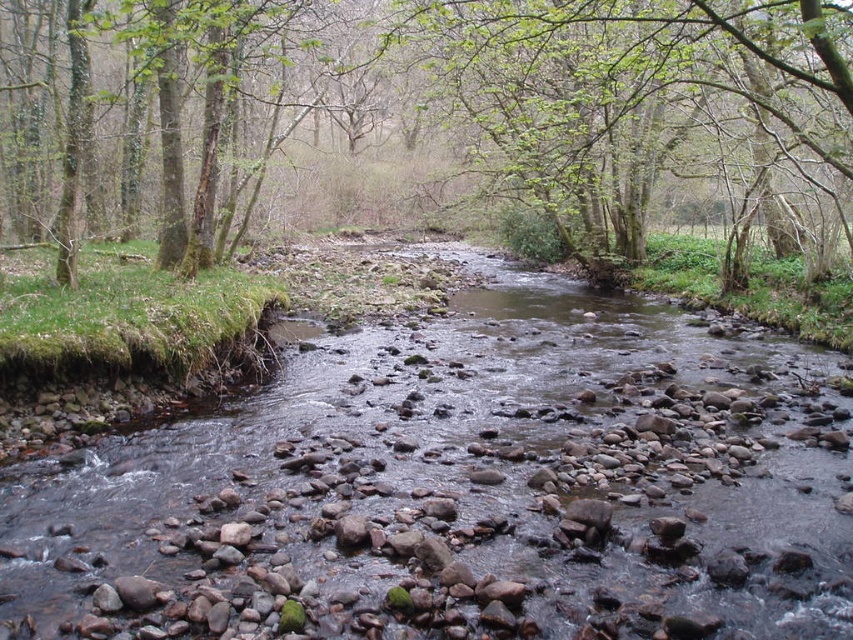
Question: Is smooth rock stream at center above green mossy tree at center?

Choices:
 (A) yes
 (B) no

Answer: (B)

Question: Can you confirm if smooth rock stream at center is smaller than green mossy tree at center?

Choices:
 (A) no
 (B) yes

Answer: (B)

Question: Is smooth rock stream at center thinner than green mossy tree at center?

Choices:
 (A) no
 (B) yes

Answer: (B)